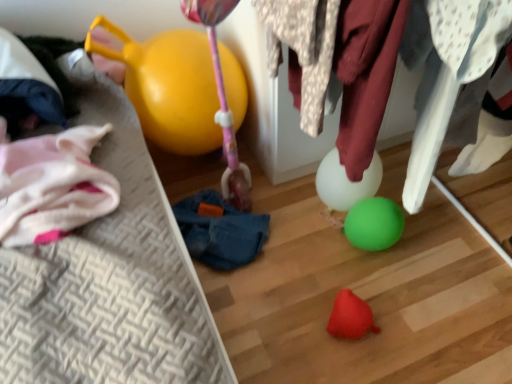
At what (x,y) coordinates should I click in order to perform the action: click on vacant space behind blue fabric bean bag chair at center. Please return your answer as a coordinate pair (x, y). The height and width of the screenshot is (384, 512). Looking at the image, I should click on (210, 174).